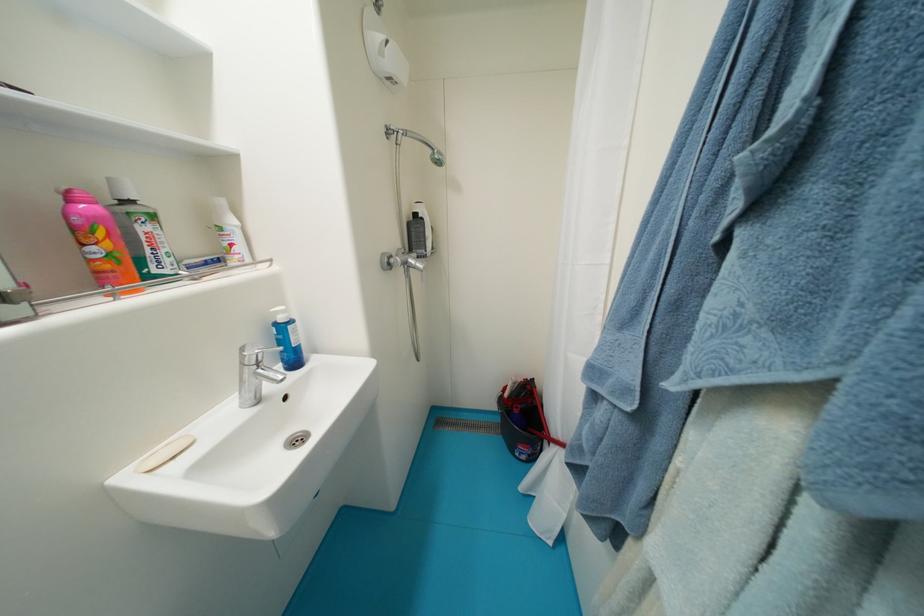
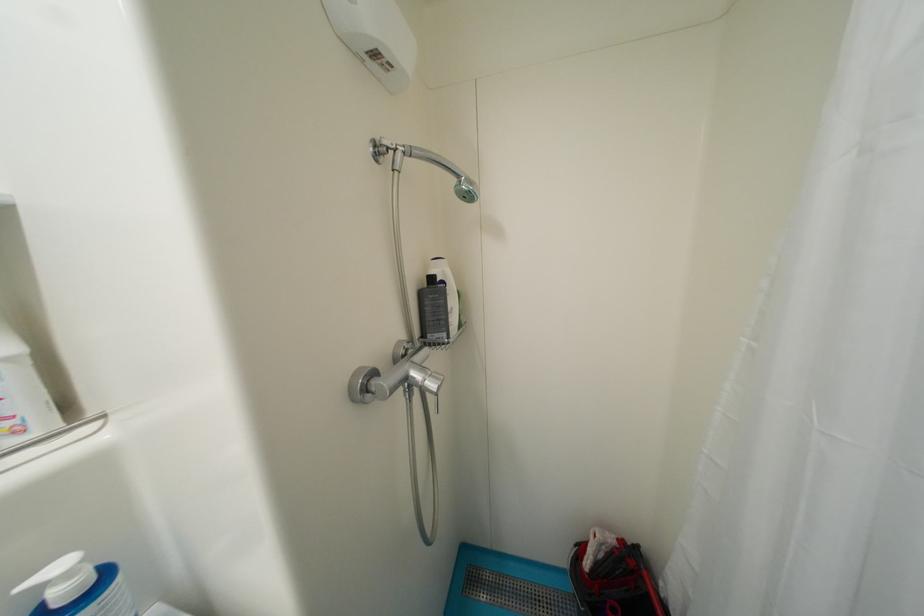
Question: Which direction would the cameraman need to move to produce the second image? Reply with the corresponding letter.

Choices:
 (A) Left
 (B) Right
 (C) Forward
 (D) Backward

Answer: (C)